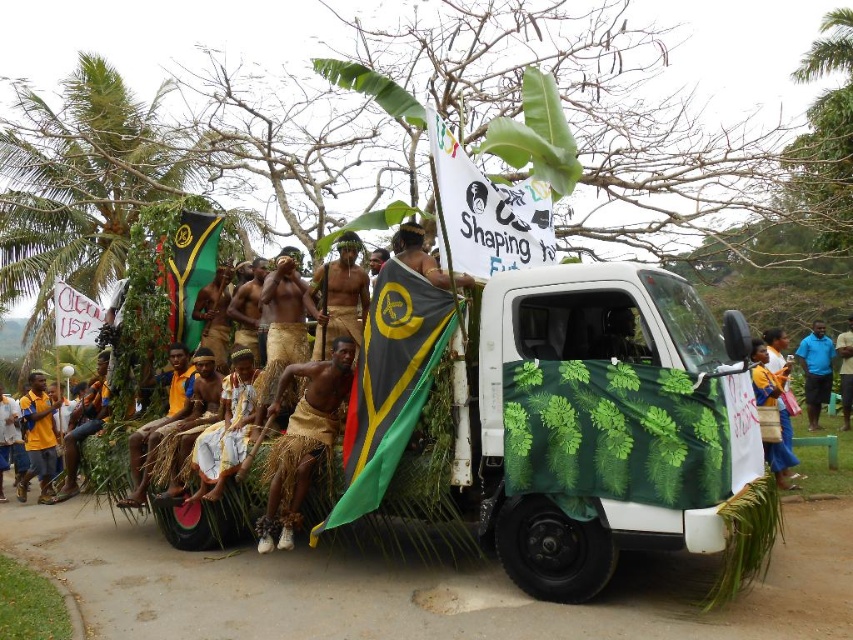
Measure the distance from green leafy banana tree at left to white paper banner at upper center.

green leafy banana tree at left and white paper banner at upper center are 12.17 meters apart.

Can you confirm if green leafy banana tree at left is thinner than white paper banner at upper center?

Yes, green leafy banana tree at left is thinner than white paper banner at upper center.

Is point (189, 154) closer to camera compared to point (483, 228)?

No, (189, 154) is further to viewer.

Image resolution: width=853 pixels, height=640 pixels. Find the location of `green leafy banana tree at left`. green leafy banana tree at left is located at coordinates (79, 186).

Does tan woven skirt at center appear over white fabric at center?

Actually, tan woven skirt at center is below white fabric at center.

Is the position of tan woven skirt at center more distant than that of white fabric at center?

No, it is not.

Does point (312, 435) lie behind point (206, 444)?

No, (312, 435) is in front of (206, 444).

You are a GUI agent. You are given a task and a screenshot of the screen. Output one action in this format:
    pyautogui.click(x=<x>, y=<y>)
    Task: Click on the tan woven skirt at center
    
    Given the screenshot: What is the action you would take?
    pyautogui.click(x=303, y=440)

Which of these two, white paper banner at upper center or blue shirt at center, stands taller?

With more height is blue shirt at center.

Is white paper banner at upper center below blue shirt at center?

No.

Image resolution: width=853 pixels, height=640 pixels. What do you see at coordinates (486, 212) in the screenshot?
I see `white paper banner at upper center` at bounding box center [486, 212].

Identify the location of white paper banner at upper center. (486, 212).